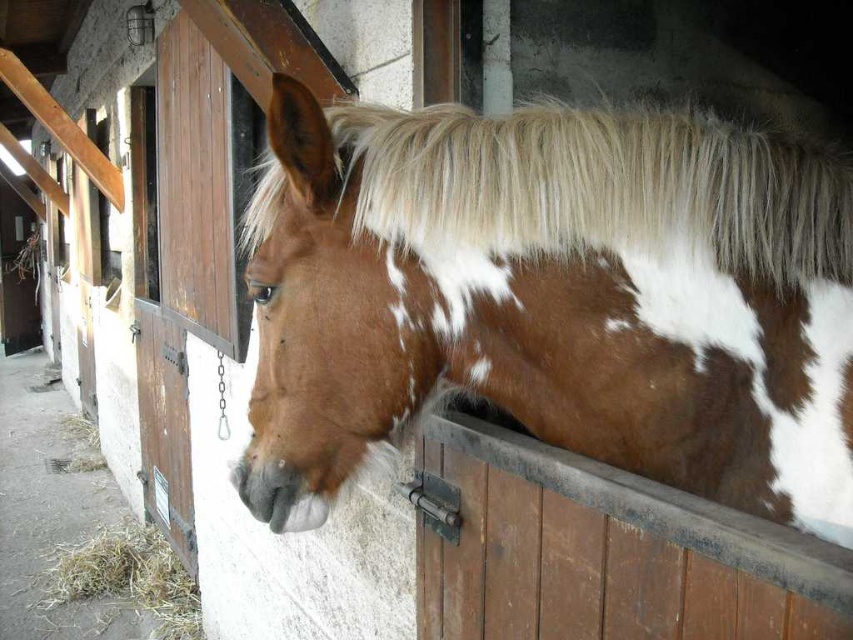
Question: Which of the following is the farthest from the observer?

Choices:
 (A) (849, 276)
 (B) (64, 552)
 (C) (265, 364)
 (D) (596, 392)

Answer: (B)

Question: Is brown speckled fur at center to the left of yellow dry hay at lower left from the viewer's perspective?

Choices:
 (A) no
 (B) yes

Answer: (A)

Question: Can you confirm if brown speckled fur at center is thinner than white silky mane at upper center?

Choices:
 (A) no
 (B) yes

Answer: (A)

Question: Among these objects, which one is farthest from the camera?

Choices:
 (A) brown speckled fur at center
 (B) brown matte nose at center
 (C) white silky mane at upper center
 (D) yellow dry hay at lower left

Answer: (D)

Question: Among these points, which one is farthest from the camera?

Choices:
 (A) (335, 324)
 (B) (106, 554)

Answer: (B)

Question: Does yellow dry hay at lower left appear over brown matte nose at center?

Choices:
 (A) yes
 (B) no

Answer: (B)